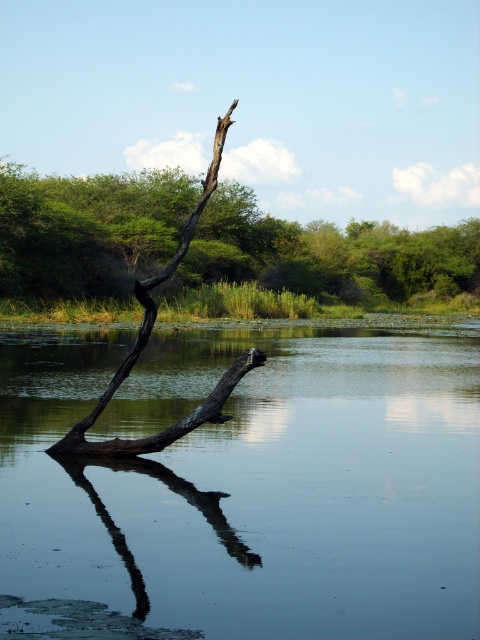
The width and height of the screenshot is (480, 640). Describe the element at coordinates (252, 483) in the screenshot. I see `smooth water at center` at that location.

Can you confirm if smooth water at center is taller than smooth dark wood branch at lower center?

Yes.

What do you see at coordinates (252, 483) in the screenshot?
I see `smooth water at center` at bounding box center [252, 483].

Identify the location of smooth water at center. (252, 483).

Can you confirm if dark brown wood at center is positioned to the right of smooth dark wood branch at lower center?

Incorrect, dark brown wood at center is not on the right side of smooth dark wood branch at lower center.

Who is taller, dark brown wood at center or smooth dark wood branch at lower center?

dark brown wood at center

Is point (133, 451) farther from viewer compared to point (108, 524)?

Yes, it is behind point (108, 524).

The image size is (480, 640). Identify the location of dark brown wood at center. (146, 340).

How much distance is there between smooth water at center and brown rough tree trunk at center?

smooth water at center is 39.57 meters from brown rough tree trunk at center.

Is point (156, 348) positioned in front of point (86, 298)?

Yes, it is in front of point (86, 298).

At what (x,y) coordinates should I click in order to perform the action: click on smooth water at center. Please return your answer as a coordinate pair (x, y). This screenshot has height=640, width=480. Looking at the image, I should click on (252, 483).